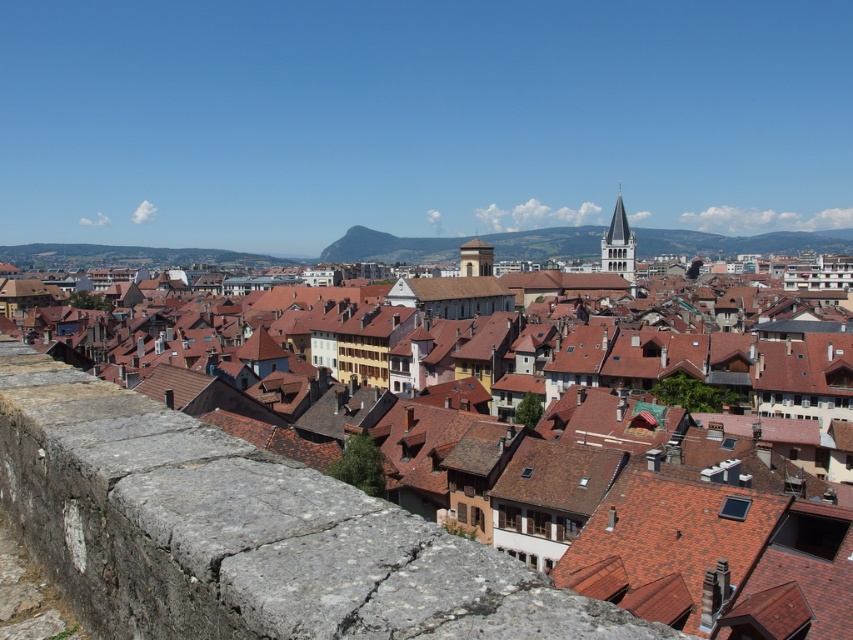
Is stone wall at lower left taller than smooth white tower at upper center?

No, stone wall at lower left is not taller than smooth white tower at upper center.

Who is more forward, (21, 426) or (630, 269)?

Positioned in front is point (21, 426).

Does point (323, 609) lie behind point (621, 220)?

No, it is in front of (621, 220).

The height and width of the screenshot is (640, 853). Identify the location of stone wall at lower left. (241, 532).